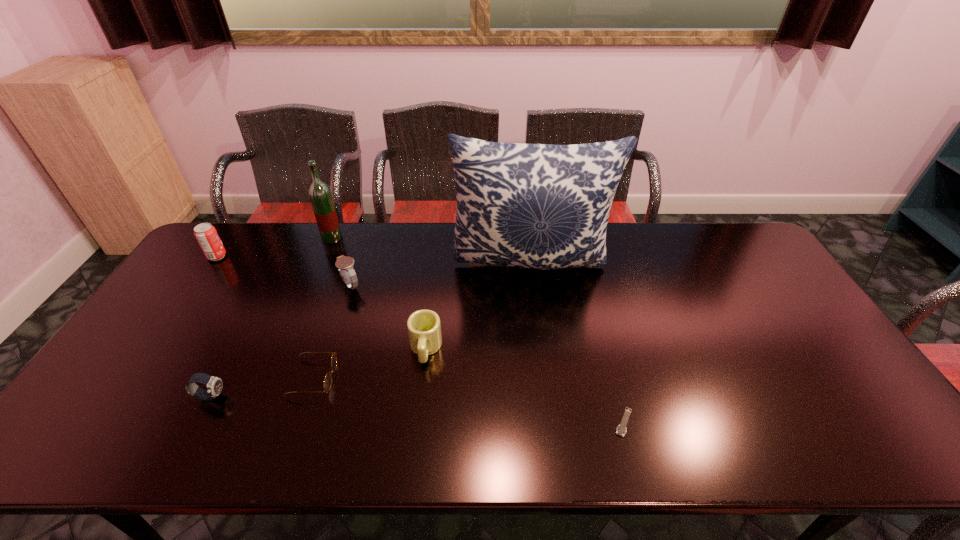
In order to click on free space located on the left of the rightmost watch in this screenshot , I will do `click(494, 422)`.

Where is `cushion located in the far edge section of the desktop`? cushion located in the far edge section of the desktop is located at coordinates [x=540, y=206].

The height and width of the screenshot is (540, 960). I want to click on liquor positioned at the far edge, so click(319, 192).

The height and width of the screenshot is (540, 960). Identify the location of soda can that is at the far edge. (206, 234).

Where is `object that is at the near edge`? The image size is (960, 540). object that is at the near edge is located at coordinates (621, 430).

This screenshot has height=540, width=960. In order to click on object at the left edge in this screenshot , I will do `click(206, 234)`.

This screenshot has width=960, height=540. Identify the location of object that is at the far left corner. (206, 234).

Find the location of a particular element. This screenshot has height=540, width=960. vacant area at the far edge is located at coordinates (397, 241).

In order to click on free region at the near edge in this screenshot , I will do (768, 433).

The height and width of the screenshot is (540, 960). I want to click on vacant region at the left edge of the desktop, so click(x=143, y=383).